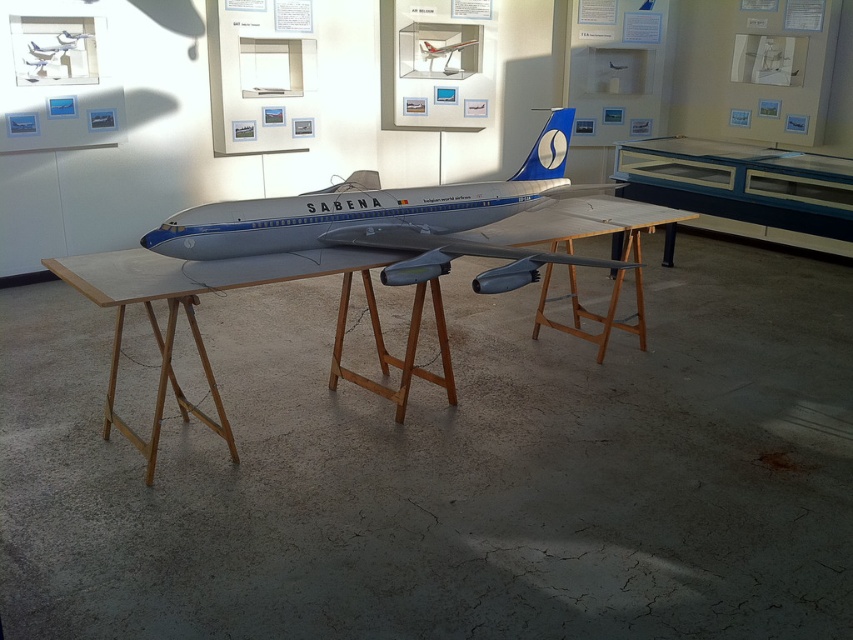
Question: Is wooden at center to the right of matte silver airplane at center from the viewer's perspective?

Choices:
 (A) no
 (B) yes

Answer: (A)

Question: Which object is the closest to the wooden at center?

Choices:
 (A) transparent glass display case at center
 (B) matte silver airplane at upper center

Answer: (A)

Question: Does wooden at center have a lesser width compared to matte silver airplane at upper center?

Choices:
 (A) yes
 (B) no

Answer: (B)

Question: From the image, what is the correct spatial relationship of wooden at center in relation to matte silver airplane at center?

Choices:
 (A) left
 (B) right

Answer: (A)

Question: Which point appears farthest from the camera in this image?

Choices:
 (A) (397, 401)
 (B) (699, 211)
 (C) (512, 180)

Answer: (B)

Question: Among these points, which one is nearest to the camera?

Choices:
 (A) (682, 202)
 (B) (488, 214)

Answer: (B)